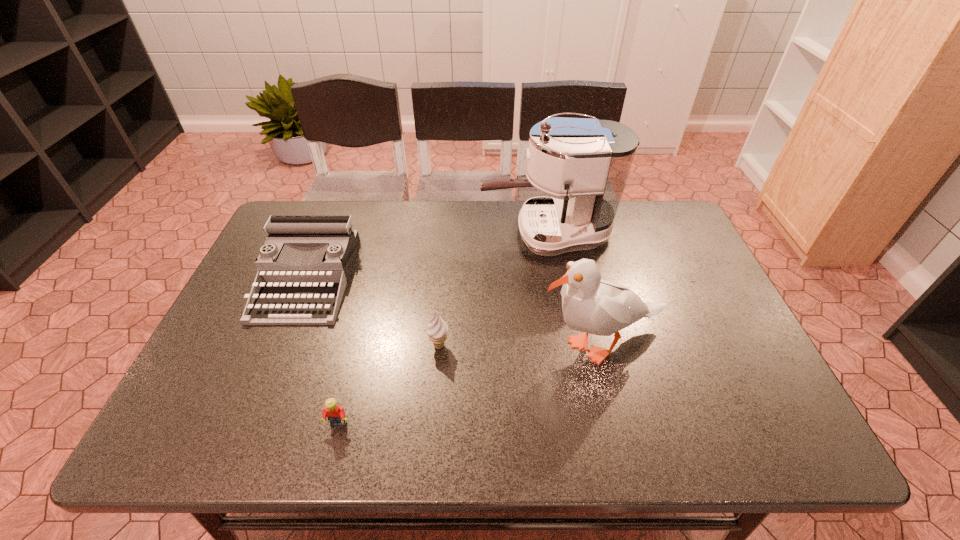
You are a GUI agent. You are given a task and a screenshot of the screen. Output one action in this format:
    pyautogui.click(x=<x>, y=<y>)
    Task: Click on the free space at the near edge
    
    Given the screenshot: What is the action you would take?
    pyautogui.click(x=587, y=434)

Where is `vacant space in between the icecream and the typewriter`? vacant space in between the icecream and the typewriter is located at coordinates (373, 312).

Identify the location of empty space between the leftmost object and the icecream. The image size is (960, 540). (373, 312).

Locate an element on the screen. free space between the tallest object and the leftmost object is located at coordinates (427, 256).

Where is `empty space that is in between the second object from left to right and the typewriter`? empty space that is in between the second object from left to right and the typewriter is located at coordinates (323, 351).

Where is `free space between the gull and the third object from right to left`? The width and height of the screenshot is (960, 540). free space between the gull and the third object from right to left is located at coordinates (520, 346).

Image resolution: width=960 pixels, height=540 pixels. In order to click on free spot between the tallest object and the leftmost object in this screenshot , I will do `click(427, 256)`.

This screenshot has height=540, width=960. What are the coordinates of `free spot between the third object from left to right and the coffee maker` in the screenshot? It's located at pos(493,290).

The height and width of the screenshot is (540, 960). What are the coordinates of `object that is the third closest to the coffee maker` in the screenshot? It's located at (295, 298).

Locate an element on the screen. The image size is (960, 540). object that is the third closest to the leftmost object is located at coordinates (589, 160).